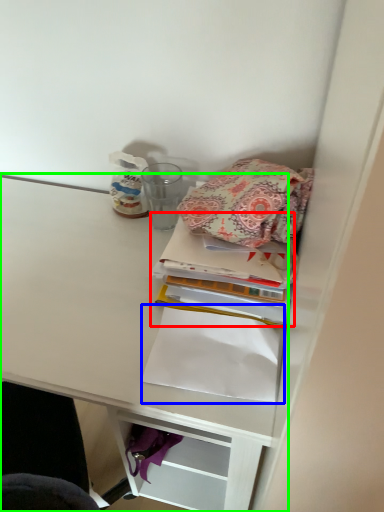
Question: Which object is positioned farthest from book (highlighted by a red box)? Select from notebook (highlighted by a blue box) and shelf (highlighted by a green box).

Choices:
 (A) notebook
 (B) shelf

Answer: (B)